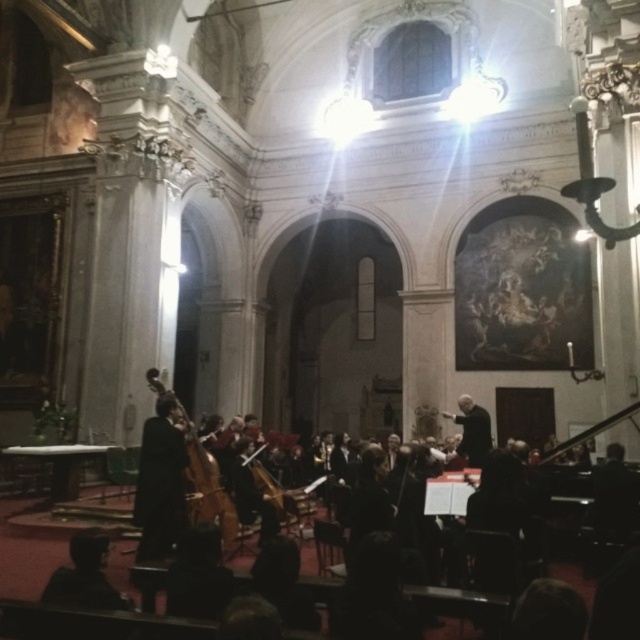
Question: Which object is positioned closest to the dark brown hair at lower left?

Choices:
 (A) black matte conductor at center
 (B) black velvet suit at center

Answer: (B)

Question: Can you confirm if wooden polished cello at center is wider than black matte conductor at center?

Choices:
 (A) yes
 (B) no

Answer: (A)

Question: Which point is farther from the camera taking this photo?

Choices:
 (A) (140, 499)
 (B) (468, 401)

Answer: (B)

Question: Estimate the real-world distances between objects in this image. Which object is farther from the wooden polished cello at center?

Choices:
 (A) dark brown hair at lower left
 (B) black matte conductor at center
 (C) black velvet suit at center

Answer: (B)

Question: Does wooden polished cello at center have a greater width compared to black matte conductor at center?

Choices:
 (A) no
 (B) yes

Answer: (B)

Question: Can you confirm if black velvet suit at center is positioned to the right of black matte conductor at center?

Choices:
 (A) no
 (B) yes

Answer: (A)